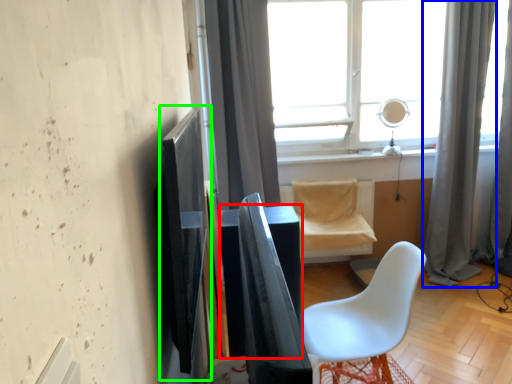
Question: Considering the real-world distances, which object is farthest from table (highlighted by a red box)? curtain (highlighted by a blue box) or screen door (highlighted by a green box)?

Choices:
 (A) curtain
 (B) screen door

Answer: (A)